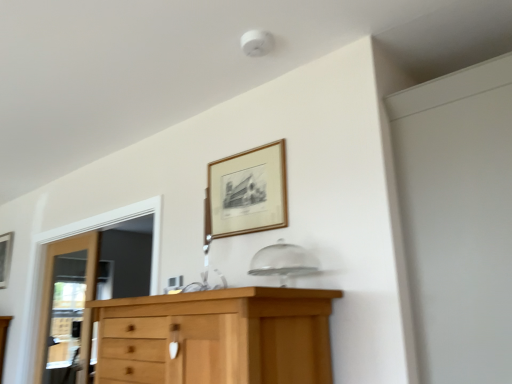
Question: Looking at their shapes, would you say wooden picture frame at left, placed as the second picture frame when sorted from right to left, is wider or thinner than wooden door at left?

Choices:
 (A) wide
 (B) thin

Answer: (B)

Question: Which is correct: wooden picture frame at left, which appears as the second picture frame when viewed from the front, is inside wooden door at left, or outside of it?

Choices:
 (A) outside
 (B) inside

Answer: (A)

Question: Based on their relative distances, which object is nearer to the wooden picture frame at upper center, the 1th picture frame positioned from the right?

Choices:
 (A) white matte screen door at upper right
 (B) wooden picture frame at left, which is the first picture frame in bottom-to-top order
 (C) wooden door at left

Answer: (A)

Question: Which is farther from the wooden door at left?

Choices:
 (A) white matte screen door at upper right
 (B) wooden picture frame at left, which ranks as the first picture frame in back-to-front order
 (C) wooden picture frame at upper center, acting as the 2th picture frame starting from the back

Answer: (A)